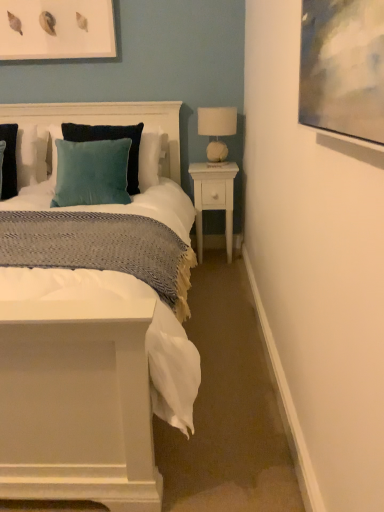
Question: Is velvet teal pillow at center aimed at velvet cushion at upper left?

Choices:
 (A) no
 (B) yes

Answer: (B)

Question: Does velvet teal pillow at center appear on the right side of velvet cushion at upper left?

Choices:
 (A) no
 (B) yes

Answer: (A)

Question: From the image's perspective, is velvet teal pillow at center beneath velvet cushion at upper left?

Choices:
 (A) no
 (B) yes

Answer: (A)

Question: Can you confirm if velvet teal pillow at center is thinner than velvet cushion at upper left?

Choices:
 (A) yes
 (B) no

Answer: (A)

Question: Is velvet teal pillow at center outside velvet cushion at upper left?

Choices:
 (A) no
 (B) yes

Answer: (A)

Question: From the image's perspective, relative to velvet teal pillow at center, is white wood nightstand at right above or below?

Choices:
 (A) below
 (B) above

Answer: (A)

Question: In the image, is white wood nightstand at right on the left side or the right side of velvet teal pillow at center?

Choices:
 (A) left
 (B) right

Answer: (B)

Question: Considering the positions of white wood nightstand at right and velvet teal pillow at center in the image, is white wood nightstand at right taller or shorter than velvet teal pillow at center?

Choices:
 (A) short
 (B) tall

Answer: (B)

Question: In terms of width, does white wood nightstand at right look wider or thinner when compared to velvet teal pillow at center?

Choices:
 (A) wide
 (B) thin

Answer: (A)

Question: From the image's perspective, is matte white picture frame at upper left above or below velvet cushion at upper left?

Choices:
 (A) above
 (B) below

Answer: (A)

Question: From a real-world perspective, is matte white picture frame at upper left physically located above or below velvet cushion at upper left?

Choices:
 (A) below
 (B) above

Answer: (B)

Question: Is matte white picture frame at upper left taller or shorter than velvet cushion at upper left?

Choices:
 (A) tall
 (B) short

Answer: (B)

Question: Would you say matte white picture frame at upper left is to the left or to the right of velvet cushion at upper left in the picture?

Choices:
 (A) left
 (B) right

Answer: (A)

Question: From a real-world perspective, is velvet cushion at upper left physically located above or below white wood nightstand at right?

Choices:
 (A) below
 (B) above

Answer: (B)

Question: Is velvet cushion at upper left wider or thinner than white wood nightstand at right?

Choices:
 (A) thin
 (B) wide

Answer: (B)